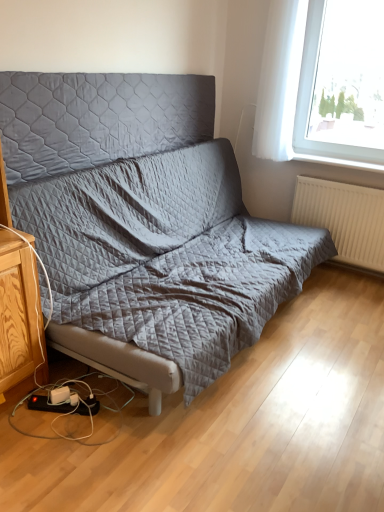
Question: Does transparent glass window at upper right have a lesser height compared to quilted fabric studio couch at center?

Choices:
 (A) yes
 (B) no

Answer: (B)

Question: Is transparent glass window at upper right oriented away from quilted fabric studio couch at center?

Choices:
 (A) no
 (B) yes

Answer: (A)

Question: Is transparent glass window at upper right not within quilted fabric studio couch at center?

Choices:
 (A) no
 (B) yes

Answer: (B)

Question: Is transparent glass window at upper right aimed at quilted fabric studio couch at center?

Choices:
 (A) no
 (B) yes

Answer: (B)

Question: Is transparent glass window at upper right surrounding quilted fabric studio couch at center?

Choices:
 (A) yes
 (B) no

Answer: (B)

Question: Does transparent glass window at upper right come behind quilted fabric studio couch at center?

Choices:
 (A) yes
 (B) no

Answer: (A)

Question: Considering the relative sizes of white textured radiator at right and quilted fabric headboard at upper center in the image provided, is white textured radiator at right taller than quilted fabric headboard at upper center?

Choices:
 (A) no
 (B) yes

Answer: (B)

Question: Is quilted fabric headboard at upper center surrounded by white textured radiator at right?

Choices:
 (A) yes
 (B) no

Answer: (B)

Question: Is white textured radiator at right touching quilted fabric headboard at upper center?

Choices:
 (A) no
 (B) yes

Answer: (A)

Question: From the image's perspective, is white textured radiator at right above quilted fabric headboard at upper center?

Choices:
 (A) yes
 (B) no

Answer: (B)

Question: From a real-world perspective, is white textured radiator at right over quilted fabric headboard at upper center?

Choices:
 (A) no
 (B) yes

Answer: (A)

Question: Considering the relative sizes of white textured radiator at right and quilted fabric headboard at upper center in the image provided, is white textured radiator at right wider than quilted fabric headboard at upper center?

Choices:
 (A) no
 (B) yes

Answer: (B)

Question: Is quilted fabric headboard at upper center touching quilted fabric studio couch at center?

Choices:
 (A) no
 (B) yes

Answer: (A)